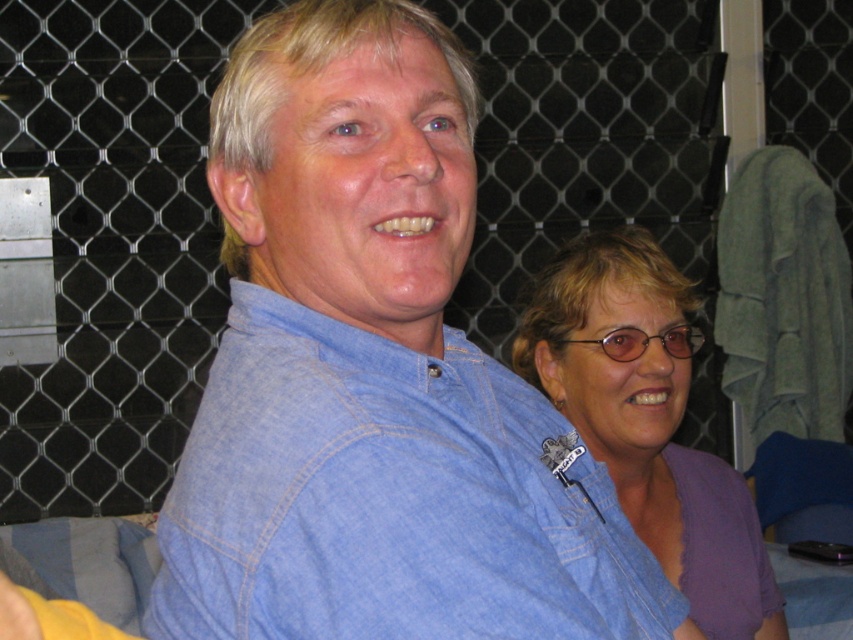
Where is `denim shirt at upper center`? denim shirt at upper center is located at coordinates (389, 499).

Is denim shirt at upper center positioned at the back of purple cotton shirt at right?

No, it is in front of purple cotton shirt at right.

What do you see at coordinates (389, 499) in the screenshot? Image resolution: width=853 pixels, height=640 pixels. I see `denim shirt at upper center` at bounding box center [389, 499].

The height and width of the screenshot is (640, 853). Find the location of `denim shirt at upper center`. denim shirt at upper center is located at coordinates (389, 499).